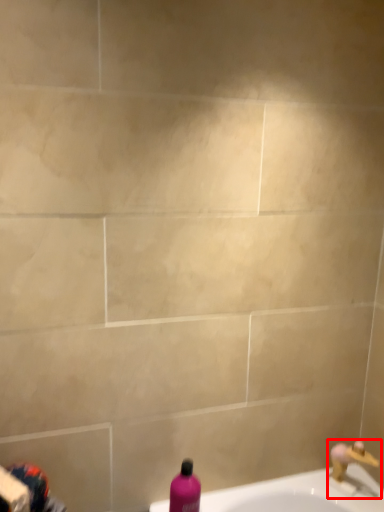
Question: From the image's perspective, where is tap (annotated by the red box) located in relation to bottle in the image?

Choices:
 (A) above
 (B) below

Answer: (B)